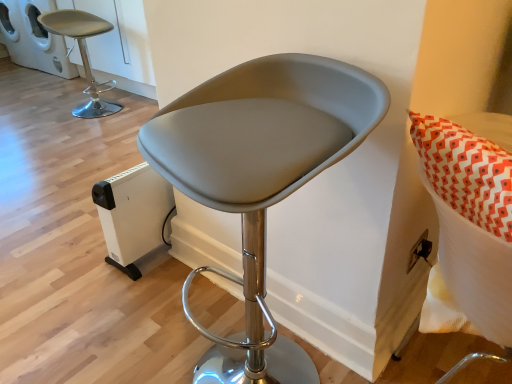
Question: Is white plastic heater at lower left, placed as the second appliance when sorted from top to bottom, further to camera compared to white plastic cat house at upper left, the second appliance from the right?

Choices:
 (A) yes
 (B) no

Answer: (B)

Question: Is white plastic heater at lower left, which is the 2th appliance from left to right, surrounding white plastic cat house at upper left, which is the first appliance in back-to-front order?

Choices:
 (A) no
 (B) yes

Answer: (A)

Question: Is white plastic heater at lower left, acting as the 1th appliance starting from the bottom, completely or partially outside of white plastic cat house at upper left, the second appliance from the right?

Choices:
 (A) yes
 (B) no

Answer: (A)

Question: From the image's perspective, is white plastic heater at lower left, the first appliance positioned from the front, above white plastic cat house at upper left, arranged as the 1th appliance when viewed from the top?

Choices:
 (A) no
 (B) yes

Answer: (A)

Question: From a real-world perspective, is white plastic heater at lower left, which is counted as the 2th appliance, starting from the back, under white plastic cat house at upper left, the 1th appliance viewed from the left?

Choices:
 (A) yes
 (B) no

Answer: (A)

Question: From a real-world perspective, is white plastic heater at lower left, placed as the second appliance when sorted from top to bottom, positioned above or below white plastic cat house at upper left, the second appliance from the right?

Choices:
 (A) above
 (B) below

Answer: (B)

Question: Is white plastic heater at lower left, the first appliance positioned from the front, taller or shorter than white plastic cat house at upper left, which is the first appliance in back-to-front order?

Choices:
 (A) short
 (B) tall

Answer: (A)

Question: Is white plastic heater at lower left, acting as the 1th appliance starting from the bottom, in front of or behind white plastic cat house at upper left, the second appliance when ordered from front to back, in the image?

Choices:
 (A) front
 (B) behind

Answer: (A)

Question: Is white plastic heater at lower left, which is counted as the 2th appliance, starting from the back, inside the boundaries of white plastic cat house at upper left, which is the 2th appliance in bottom-to-top order, or outside?

Choices:
 (A) inside
 (B) outside

Answer: (B)

Question: From their relative heights in the image, would you say matte gray stool at upper left, which appears as the 2th chair when viewed from the right, is taller or shorter than white plastic cat house at upper left, arranged as the 1th appliance when viewed from the top?

Choices:
 (A) tall
 (B) short

Answer: (A)

Question: Is matte gray stool at upper left, the 1th chair positioned from the top, in front of or behind white plastic cat house at upper left, which is the 2th appliance in bottom-to-top order, in the image?

Choices:
 (A) front
 (B) behind

Answer: (A)

Question: From the image's perspective, relative to white plastic cat house at upper left, the 1th appliance viewed from the left, is matte gray stool at upper left, the 1th chair positioned from the top, above or below?

Choices:
 (A) above
 (B) below

Answer: (B)

Question: Based on their sizes in the image, would you say matte gray stool at upper left, which appears as the 2th chair when viewed from the right, is bigger or smaller than white plastic cat house at upper left, which is the 2th appliance in bottom-to-top order?

Choices:
 (A) big
 (B) small

Answer: (B)

Question: Considering the positions of white plastic cat house at upper left, the 1th appliance viewed from the left, and matte gray stool at center, acting as the 1th chair starting from the bottom, in the image, is white plastic cat house at upper left, the 1th appliance viewed from the left, taller or shorter than matte gray stool at center, acting as the 1th chair starting from the bottom,?

Choices:
 (A) tall
 (B) short

Answer: (B)

Question: Does point (27, 3) appear closer or farther from the camera than point (263, 89)?

Choices:
 (A) farther
 (B) closer

Answer: (A)